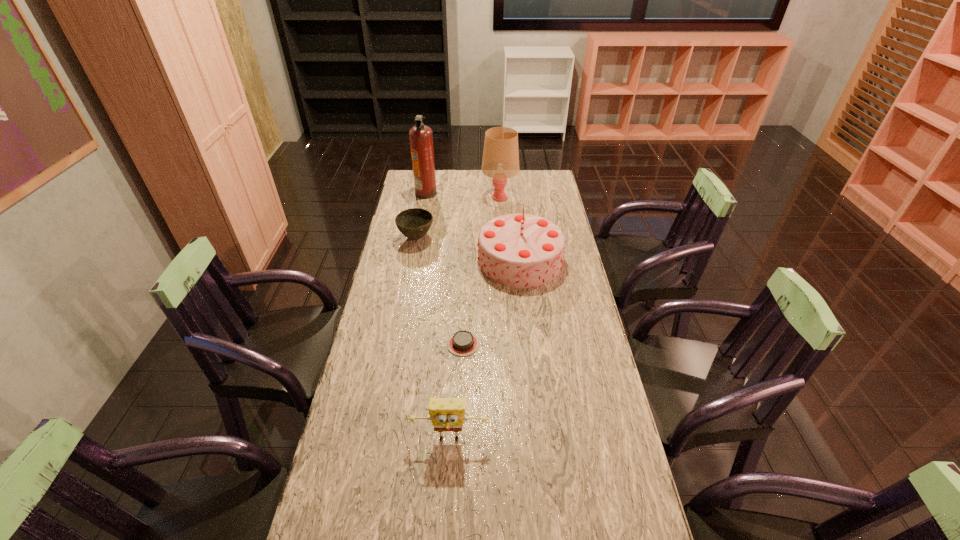
Locate an element on the screen. the tallest object is located at coordinates (421, 138).

The height and width of the screenshot is (540, 960). Identify the location of the second tallest object. (500, 161).

The width and height of the screenshot is (960, 540). I want to click on the fourth shortest object, so click(520, 250).

The width and height of the screenshot is (960, 540). Identify the location of sponge. (446, 414).

Find the location of `the third shortest object`. the third shortest object is located at coordinates pos(446,414).

In order to click on the second shortest object in this screenshot , I will do `click(414, 223)`.

In order to click on the fifth farthest object in this screenshot , I will do `click(462, 343)`.

Where is `the shortest object`? the shortest object is located at coordinates (462, 343).

What are the coordinates of `vacant position located at the nozzle of the fire extinguisher` in the screenshot? It's located at (468, 193).

Where is `vacant position located on the front of the lampshade`? The width and height of the screenshot is (960, 540). vacant position located on the front of the lampshade is located at coordinates [501, 219].